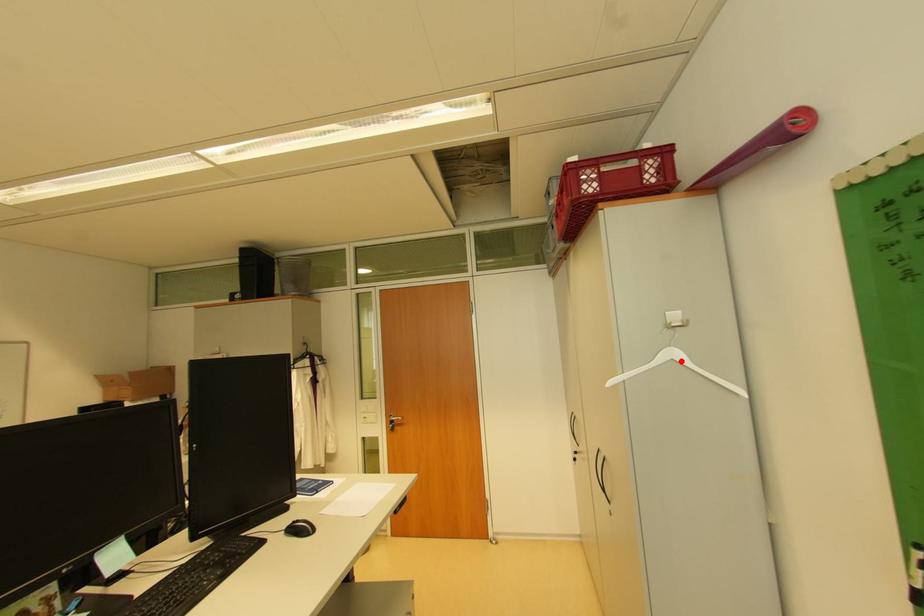
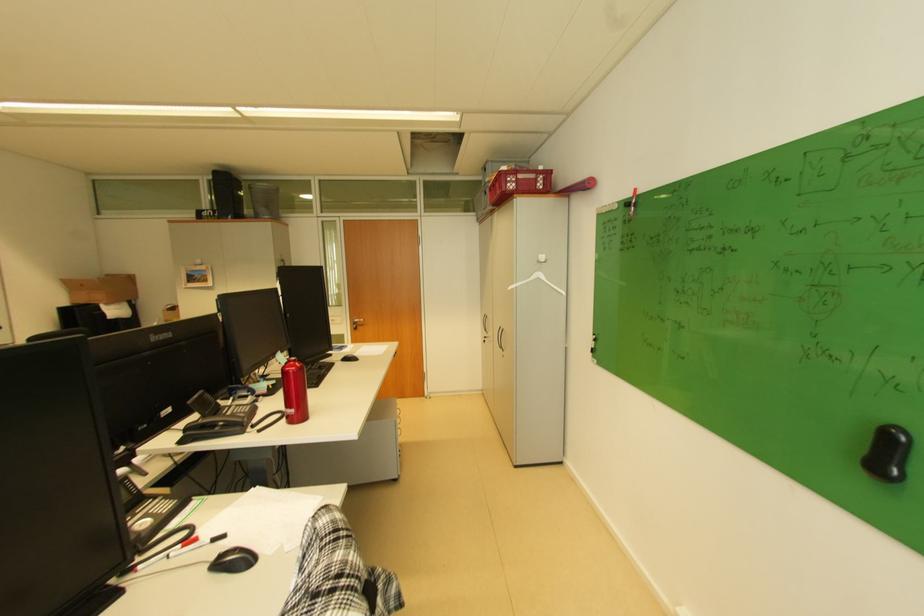
The point at the highlighted location is marked in the first image. Where is the corresponding point in the second image?

(546, 278)